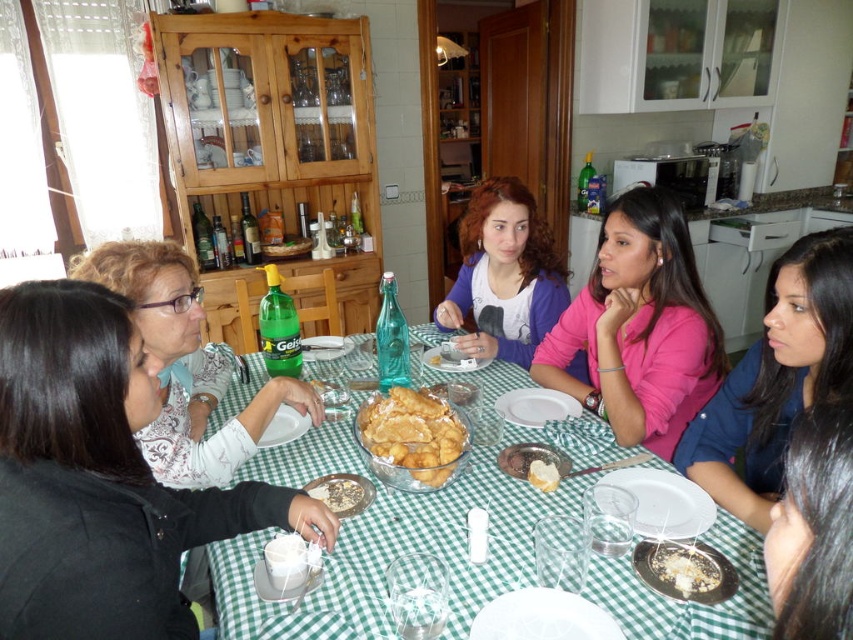
Does matte black jacket at lower left come in front of golden crispy pastry at center?

Yes, matte black jacket at lower left is closer to the viewer.

Can you confirm if matte black jacket at lower left is smaller than golden crispy pastry at center?

Incorrect, matte black jacket at lower left is not smaller in size than golden crispy pastry at center.

Which is behind, point (177, 625) or point (444, 422)?

The point (444, 422) is more distant.

The width and height of the screenshot is (853, 640). Identify the location of matte black jacket at lower left. (100, 477).

Between matte purple sweater at center and white fluffy bread at center, which one has more height?

matte purple sweater at center is taller.

Is matte purple sweater at center below white fluffy bread at center?

No, matte purple sweater at center is not below white fluffy bread at center.

This screenshot has width=853, height=640. Identify the location of matte purple sweater at center. (503, 275).

Is pink matte sweater at center further to camera compared to matte purple sweater at center?

No.

Is pink matte sweater at center thinner than matte purple sweater at center?

Incorrect, pink matte sweater at center's width is not less than matte purple sweater at center's.

What do you see at coordinates (639, 326) in the screenshot? I see `pink matte sweater at center` at bounding box center [639, 326].

The height and width of the screenshot is (640, 853). What are the coordinates of `pink matte sweater at center` in the screenshot? It's located at (639, 326).